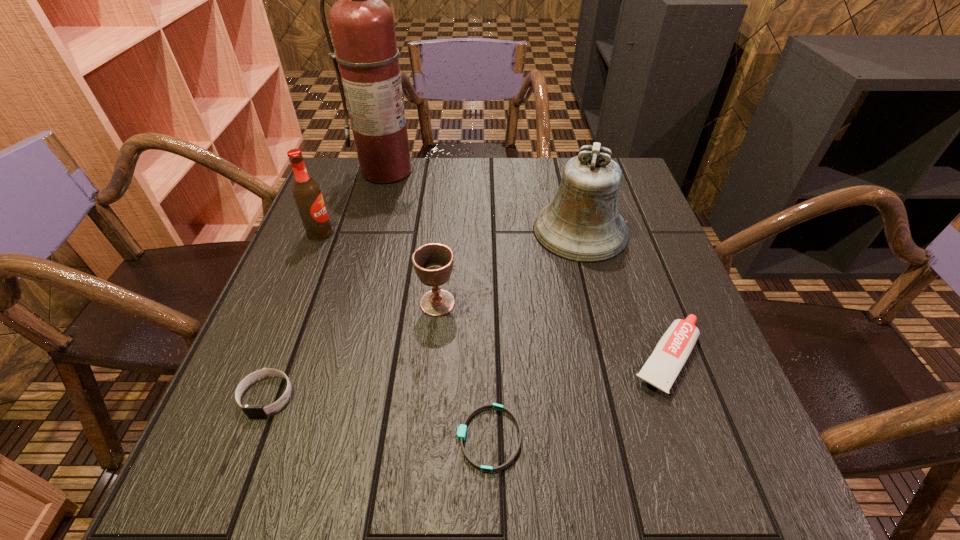
This screenshot has height=540, width=960. In order to click on fire extinguisher located in the far edge section of the desktop in this screenshot , I will do `click(362, 24)`.

Where is `bell located at the far edge`? The image size is (960, 540). bell located at the far edge is located at coordinates (582, 224).

At what (x,y) coordinates should I click in order to perform the action: click on object at the near edge. Please return your answer as a coordinate pair (x, y). Looking at the image, I should click on (462, 429).

The image size is (960, 540). I want to click on fire extinguisher that is at the left edge, so click(x=362, y=24).

You are a GUI agent. You are given a task and a screenshot of the screen. Output one action in this format:
    pyautogui.click(x=<x>, y=<y>)
    Task: Click on the beer bottle present at the left edge
    
    Given the screenshot: What is the action you would take?
    tap(306, 192)

In order to click on wristband present at the left edge in this screenshot , I will do `click(250, 410)`.

This screenshot has height=540, width=960. I want to click on bell at the right edge, so click(582, 224).

At what (x,y) coordinates should I click in order to perform the action: click on toothpaste positioned at the right edge. Please return your answer as a coordinate pair (x, y). The height and width of the screenshot is (540, 960). Looking at the image, I should click on (661, 369).

Find the location of `object present at the far left corner`. object present at the far left corner is located at coordinates (362, 24).

Identify the location of object located at the far right corner. (582, 224).